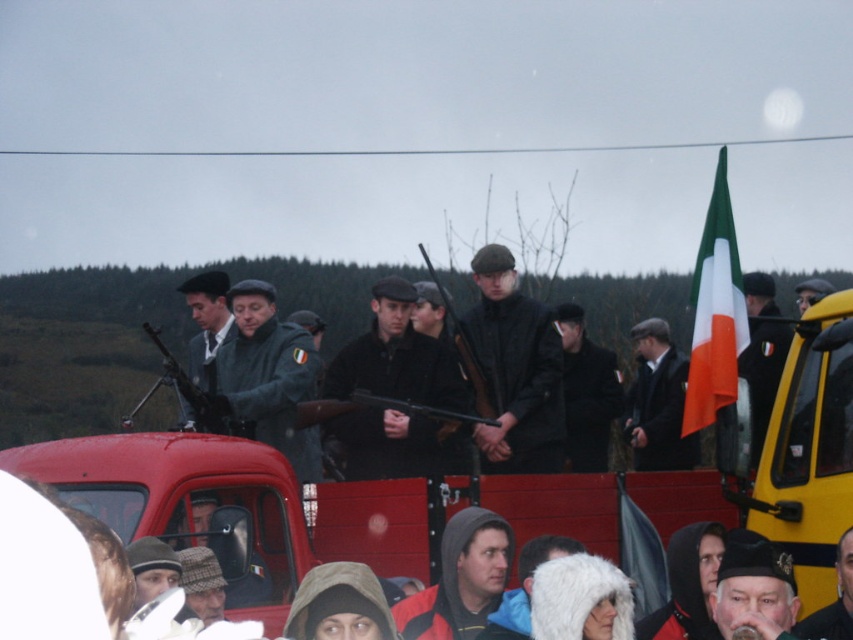
You are a photographer positioned at the front of the scene. You want to take a photo that includes both the dark gray wool cap at center and the matte black suit at center. Which object will appear larger in your photo?

The dark gray wool cap at center will appear larger in the photo because it is closer to the viewer than the matte black suit at center.

You are a photographer standing at the edge of the crowd, wanting to capture both the dark gray wool coat at center and the matte black suit at center in a single frame. Your camera has a maximum focal length that can cover a distance of 4 meters between subjects. Will you be able to include both in the shot?

The distance between the dark gray wool coat at center and the matte black suit at center is 4.15 meters. Since your camera can only cover up to 4 meters, you won